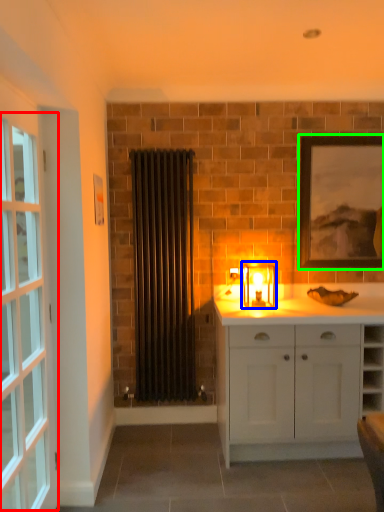
Question: Which object is positioned farthest from window (highlighted by a red box)? Select from candle holder (highlighted by a blue box) and picture frame (highlighted by a green box).

Choices:
 (A) candle holder
 (B) picture frame

Answer: (B)